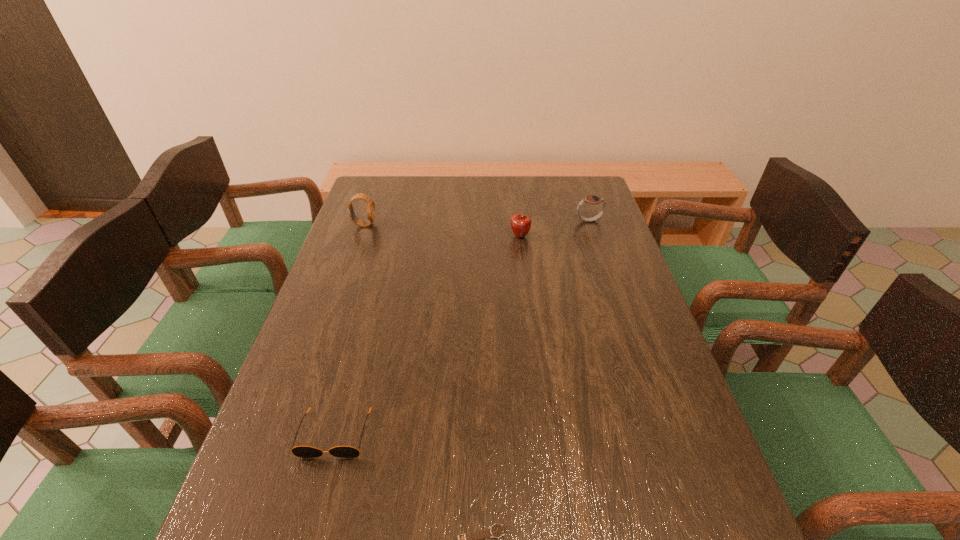
The width and height of the screenshot is (960, 540). I want to click on vacant area situated 0.280m on the right of the fourth object from left to right, so click(615, 237).

This screenshot has height=540, width=960. Find the location of `vacant area situated on the front-facing side of the fourth tallest object`. vacant area situated on the front-facing side of the fourth tallest object is located at coordinates tap(307, 539).

Image resolution: width=960 pixels, height=540 pixels. I want to click on watch positioned at the left edge, so click(x=370, y=203).

You are a GUI agent. You are given a task and a screenshot of the screen. Output one action in this format:
    pyautogui.click(x=<x>, y=<y>)
    Task: Click on the sunglasses that is positioned at the left edge
    This screenshot has height=540, width=960.
    Given the screenshot: What is the action you would take?
    pyautogui.click(x=299, y=451)

Image resolution: width=960 pixels, height=540 pixels. I want to click on object positioned at the right edge, so click(591, 199).

Find the location of a particular element. The height and width of the screenshot is (540, 960). vacant space at the far edge of the desktop is located at coordinates (526, 191).

Locate an element on the screen. The width and height of the screenshot is (960, 540). free space at the left edge of the desktop is located at coordinates (368, 233).

The width and height of the screenshot is (960, 540). In the image, there is a desktop. Identify the location of free space at the right edge. [x=624, y=347].

In the image, there is a desktop. Where is `vacant space at the far left corner`? This screenshot has width=960, height=540. vacant space at the far left corner is located at coordinates (391, 206).

In the image, there is a desktop. Where is `vacant space at the far right corner`? This screenshot has width=960, height=540. vacant space at the far right corner is located at coordinates (577, 191).